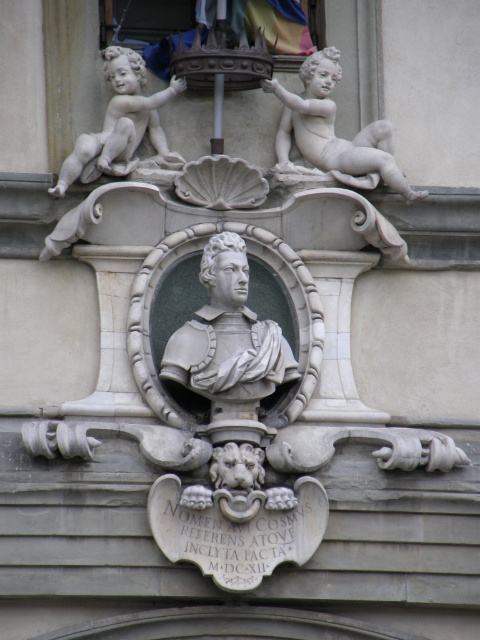
Question: Which object is positioned closest to the white marble cherub at upper left?

Choices:
 (A) gray stone bust at center
 (B) white marble cherub at upper right

Answer: (B)

Question: Among these points, which one is nearest to the camera?

Choices:
 (A) (240, 380)
 (B) (382, 124)

Answer: (A)

Question: Is white marble cherub at upper right to the right of white marble cherub at upper left from the viewer's perspective?

Choices:
 (A) yes
 (B) no

Answer: (A)

Question: Is gray stone bust at center below white marble cherub at upper left?

Choices:
 (A) no
 (B) yes

Answer: (B)

Question: Can you confirm if white marble cherub at upper right is smaller than white marble cherub at upper left?

Choices:
 (A) no
 (B) yes

Answer: (A)

Question: Which point appears closest to the camera in this image?

Choices:
 (A) (116, 154)
 (B) (392, 180)

Answer: (A)